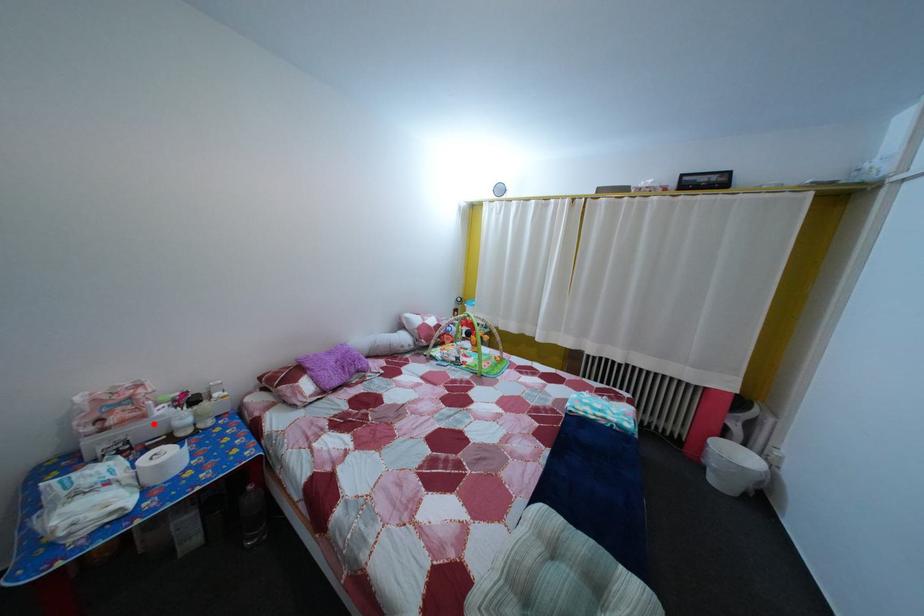
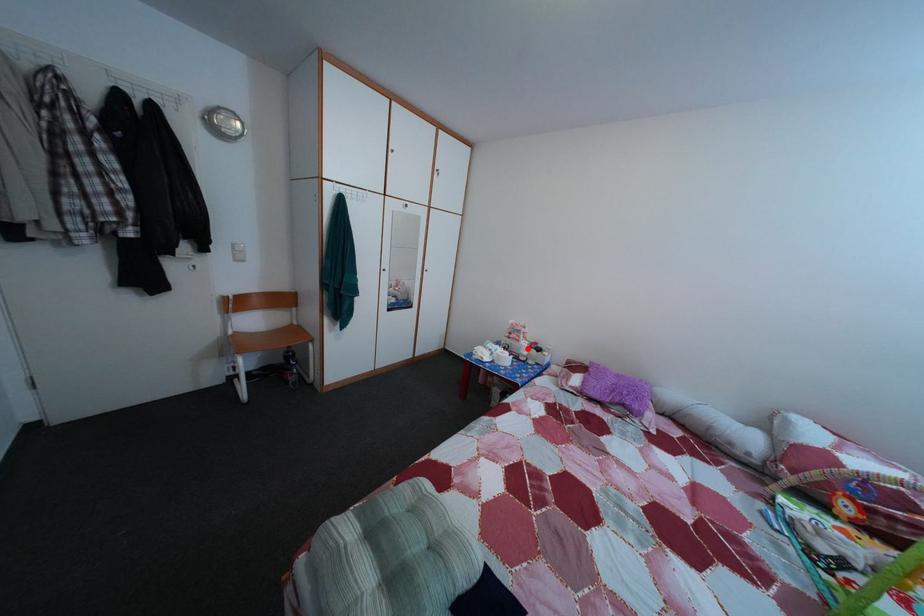
In the scene shown: I am providing you with two images of the same scene from different viewpoints. A red point is marked on the first image and another point is marked on the second image. Is the marked point in image1 the same physical position as the marked point in image2?

Yes